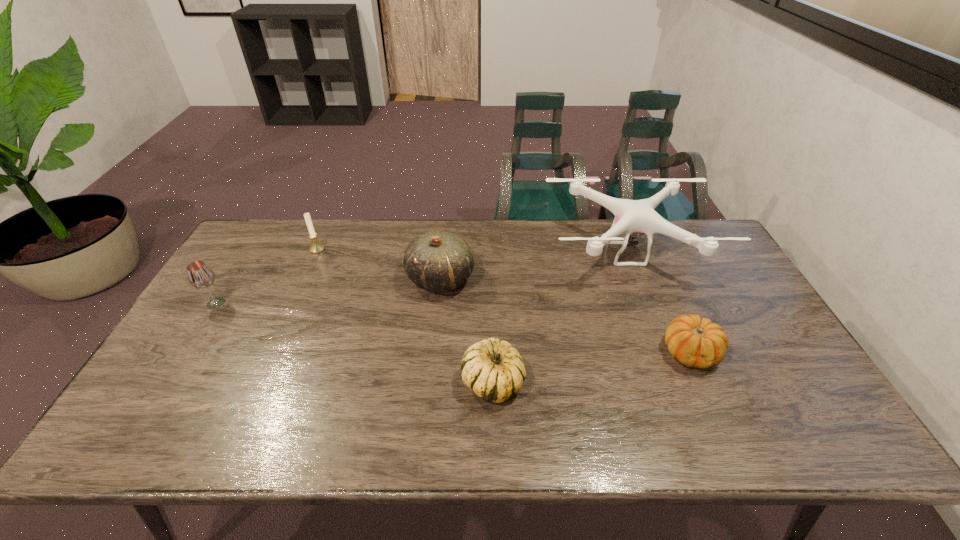
Identify the location of free region at the near edge. (534, 433).

In the image, there is a desktop. At what (x,y) coordinates should I click in order to perform the action: click on vacant region at the right edge. Please return your answer as a coordinate pair (x, y). This screenshot has height=540, width=960. Looking at the image, I should click on (749, 297).

Where is `vacant region at the far left corner of the desktop`? This screenshot has height=540, width=960. vacant region at the far left corner of the desktop is located at coordinates (258, 256).

Identify the location of unoccupied position between the second tallest gourd and the farthest gourd. This screenshot has height=540, width=960. (x=467, y=330).

Where is `vacant space that is in between the candle holder and the wineglass`? The image size is (960, 540). vacant space that is in between the candle holder and the wineglass is located at coordinates (267, 276).

This screenshot has width=960, height=540. I want to click on vacant space that is in between the shortest gourd and the fifth tallest object, so click(591, 367).

Identify the location of empty space between the fifth tallest object and the leftmost object. (354, 342).

Where is `free spot between the second shortest object and the leftmost object`? This screenshot has width=960, height=540. free spot between the second shortest object and the leftmost object is located at coordinates (354, 342).

Identify the location of blank region between the second tallest gourd and the rightmost gourd. (591, 367).

Identify the location of free spot between the tallest object and the shortest gourd. (659, 303).